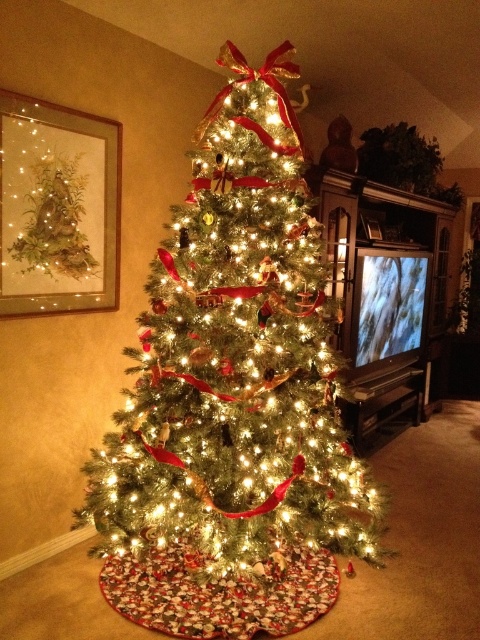
Is iridescent glass christmas tree at center shorter than matte glass painting at upper left?

No.

Between point (271, 96) and point (80, 285), which one is positioned in front?

Positioned in front is point (271, 96).

At what (x,y) coordinates should I click in order to perform the action: click on iridescent glass christmas tree at center. Please return your answer as a coordinate pair (x, y). This screenshot has height=640, width=480. Looking at the image, I should click on (237, 358).

Locate an element on the screen. This screenshot has width=480, height=640. iridescent glass christmas tree at center is located at coordinates (237, 358).